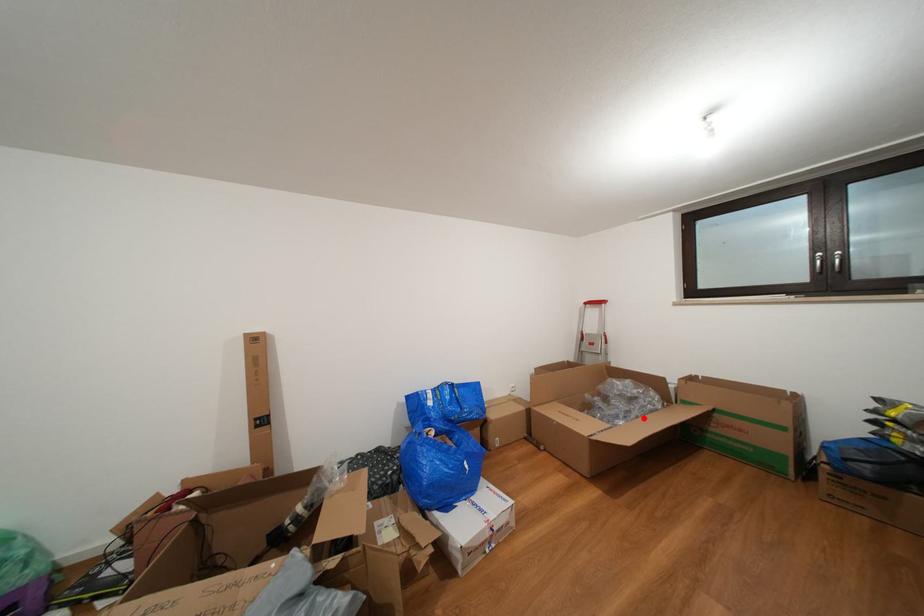
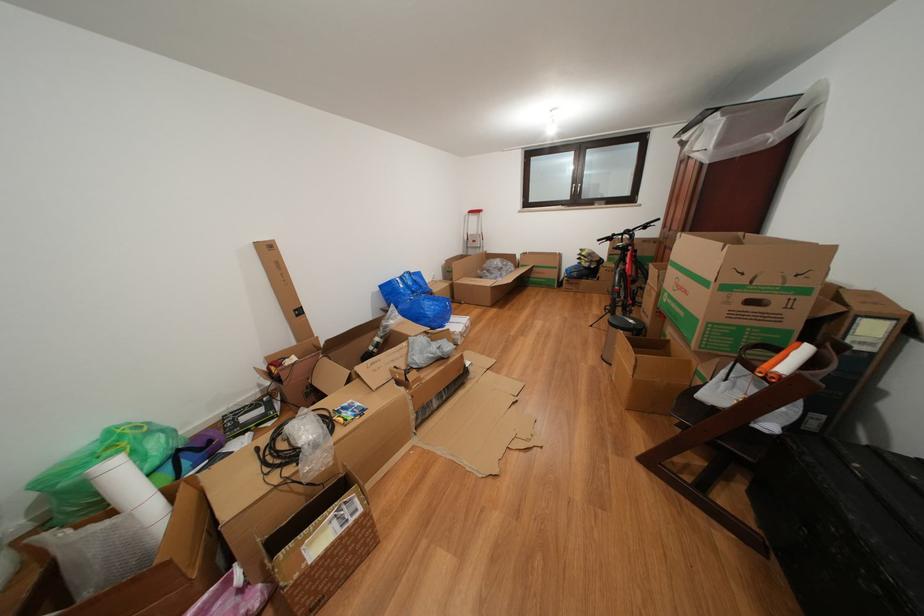
In the second image, find the point that corresponds to the highlighted location in the first image.

(513, 280)